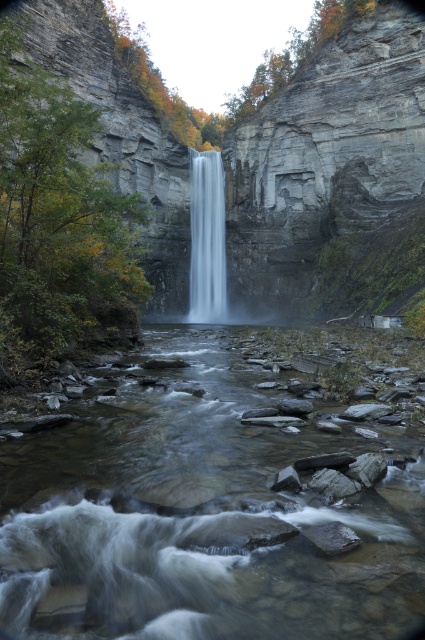
You are a photographer planning to capture the waterfall and the river in a single shot. Given that your camera can only focus on one main subject, which object between the clear water at center and the white smooth waterfall at center should you choose to ensure the larger subject is in focus?

The white smooth waterfall at center is larger than the clear water at center, so you should focus on the white smooth waterfall at center to ensure the larger subject is in focus.

You are a kayaker planning to navigate through the clear water at center and the white smooth waterfall at center. Given that your kayak can handle drops up to 50 meters, will you be able to safely pass through the waterfall?

The distance between the clear water at center and the white smooth waterfall at center is 50.42 meters. Since your kayak can handle drops up to 50 meters, the 50.42 meter drop is slightly beyond your kayak capacity, so it is not safe to proceed.